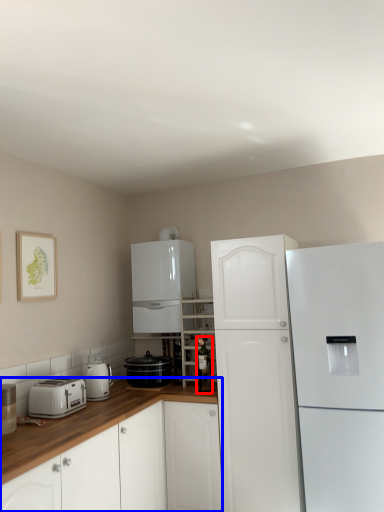
Question: Which object appears closest to the camera in this image, bottle (highlighted by a red box) or cabinetry (highlighted by a blue box)?

Choices:
 (A) bottle
 (B) cabinetry

Answer: (B)